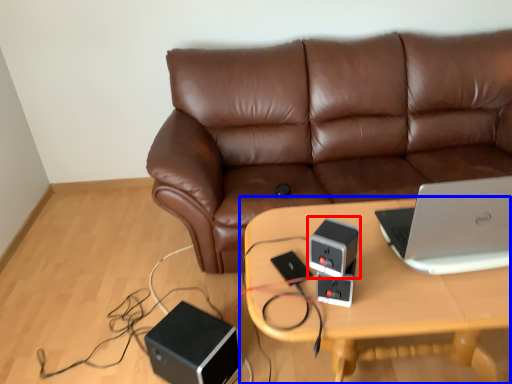
Question: Which point is further to the camera, speaker (highlighted by a red box) or table (highlighted by a blue box)?

Choices:
 (A) speaker
 (B) table

Answer: (B)